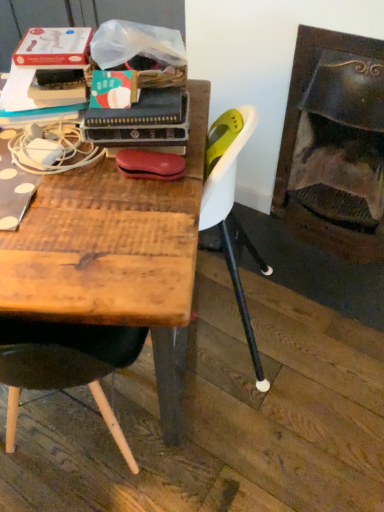
Question: Is wooden table at center positioned far away from dark brown wood fireplace at right?

Choices:
 (A) yes
 (B) no

Answer: (B)

Question: Can you confirm if wooden table at center is shorter than dark brown wood fireplace at right?

Choices:
 (A) no
 (B) yes

Answer: (B)

Question: Considering the relative sizes of wooden table at center and dark brown wood fireplace at right in the image provided, is wooden table at center taller than dark brown wood fireplace at right?

Choices:
 (A) no
 (B) yes

Answer: (A)

Question: Does wooden table at center turn towards dark brown wood fireplace at right?

Choices:
 (A) no
 (B) yes

Answer: (A)

Question: Is wooden table at center to the left of dark brown wood fireplace at right from the viewer's perspective?

Choices:
 (A) yes
 (B) no

Answer: (A)

Question: Is wooden table at center surrounding dark brown wood fireplace at right?

Choices:
 (A) no
 (B) yes

Answer: (A)

Question: Does dark brown wood fireplace at right have a greater height compared to wooden table at center?

Choices:
 (A) yes
 (B) no

Answer: (A)

Question: Can you confirm if dark brown wood fireplace at right is smaller than wooden table at center?

Choices:
 (A) yes
 (B) no

Answer: (A)

Question: Is dark brown wood fireplace at right not within wooden table at center?

Choices:
 (A) no
 (B) yes

Answer: (B)

Question: Is dark brown wood fireplace at right positioned far away from wooden table at center?

Choices:
 (A) yes
 (B) no

Answer: (B)

Question: Is dark brown wood fireplace at right behind wooden table at center?

Choices:
 (A) no
 (B) yes

Answer: (B)

Question: Is dark brown wood fireplace at right to the right of wooden table at center from the viewer's perspective?

Choices:
 (A) no
 (B) yes

Answer: (B)

Question: In terms of size, does dark brown wood fireplace at right appear bigger or smaller than wooden table at center?

Choices:
 (A) small
 (B) big

Answer: (A)